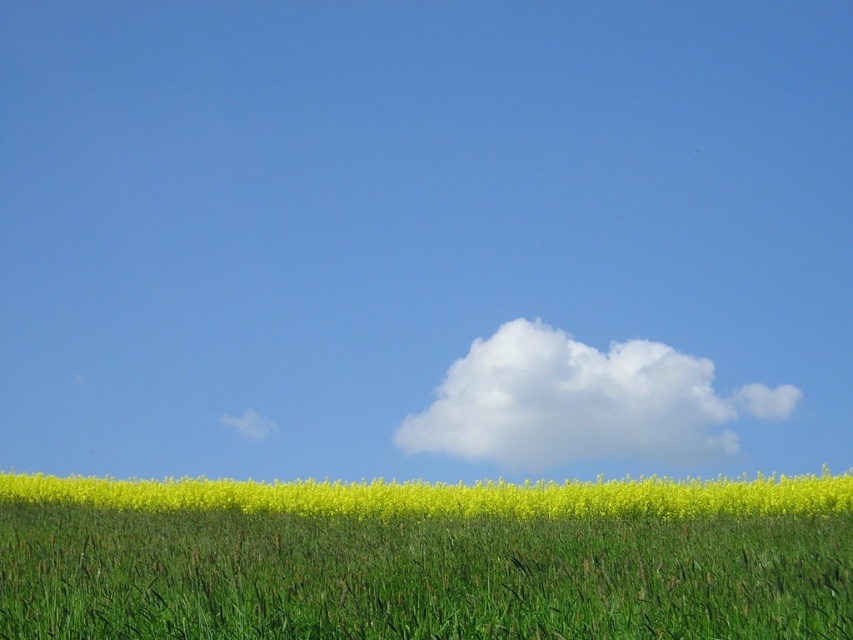
You are a photographer wanting to capture the white fluffy cloud at upper center and the yellow matte flower at lower center in a single frame. Can you position yourself so that the cloud appears directly above the flower in the photo?

Yes, the white fluffy cloud at upper center is already positioned over the yellow matte flower at lower center, so positioning yourself to frame them this way is possible.

You are standing at the center of the image and want to walk towards the green grass at lower center. According to the coordinates provided, in which general direction should you move?

The green grass at lower center is located at coordinates point (418, 577). Since the y coordinate is approximately 0.5, it is near the center vertically. The x coordinate of 0.902 is closer to the right edge of the image, so you should move towards the right direction to reach the green grass at lower center.

You are a drone operator trying to capture a photo of the green grass at lower center and the white fluffy cloud at upper center. You need to ensure both are visible in the frame. Based on their widths, which object should you adjust your focus to prioritize capturing first?

The green grass at lower center has a lesser width compared to the white fluffy cloud at upper center. Therefore, you should prioritize capturing the white fluffy cloud at upper center first since it occupies more space in the frame and might require adjusting the focus to ensure it is fully visible.